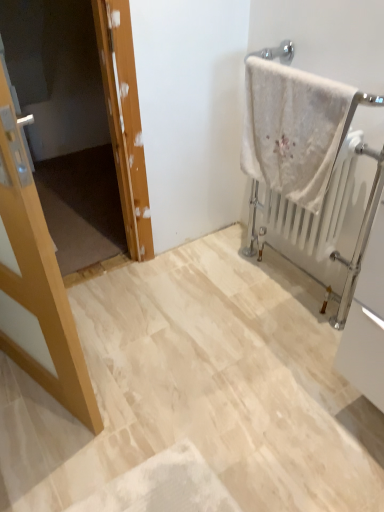
Locate an element on the screen. The height and width of the screenshot is (512, 384). free point above white fluffy towel at upper right (from a real-world perspective) is located at coordinates (283, 69).